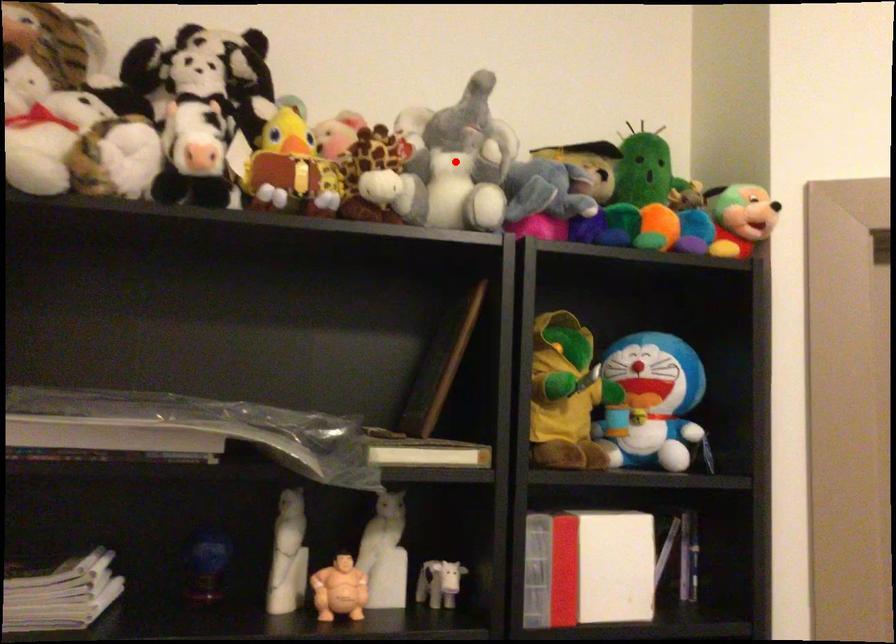
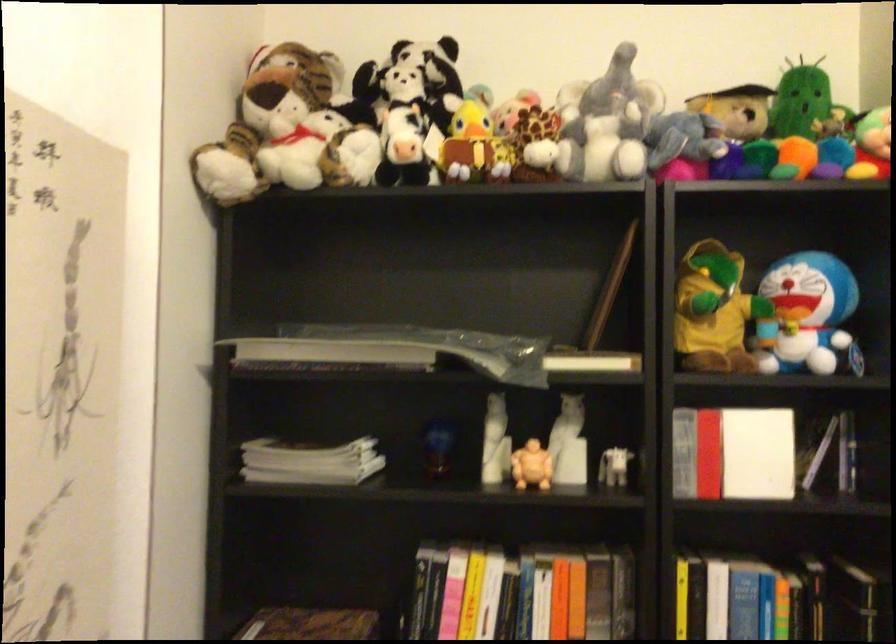
Question: I am providing you with two images of the same scene from different viewpoints. Image1 has a red point marked. In image2, the corresponding 3D location appears at what relative position? Reply with the corresponding letter.

Choices:
 (A) Closer
 (B) Farther

Answer: (B)